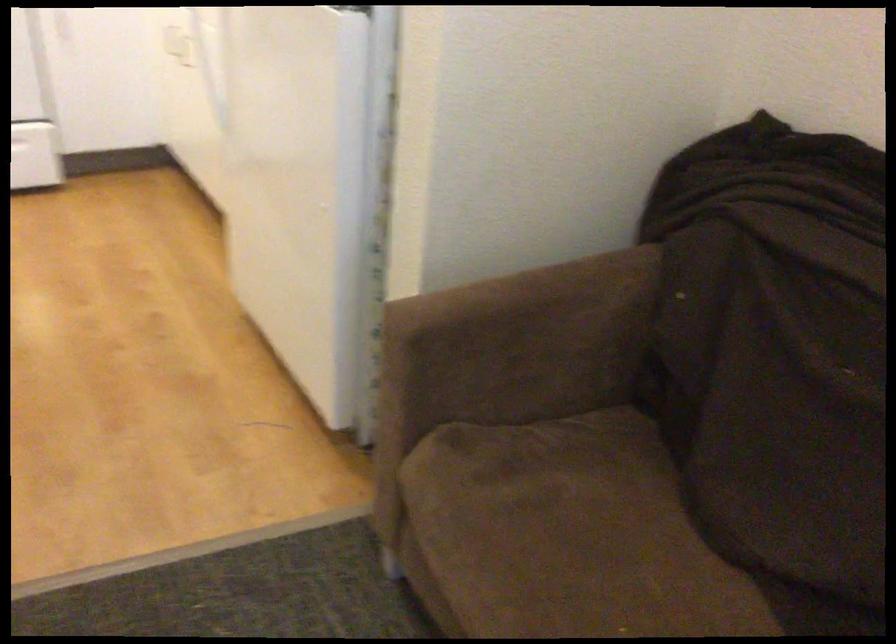
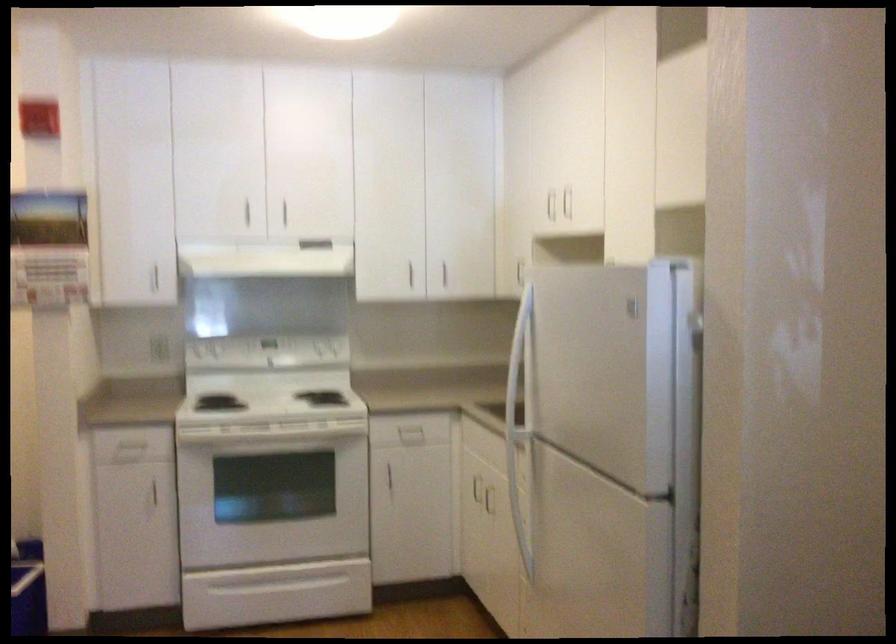
The first image is from the beginning of the video and the second image is from the end. How did the camera likely rotate when shooting the video?

The camera rotated toward left-up.